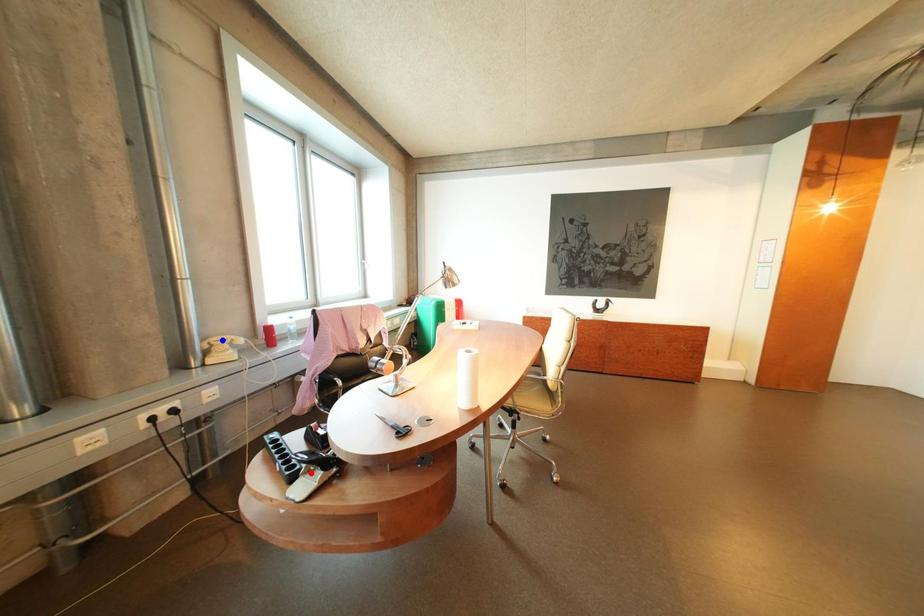
Question: In the image, two points are highlighted. Which point is nearer to the camera? Reply with the corresponding letter.

Choices:
 (A) blue point
 (B) red point

Answer: (B)